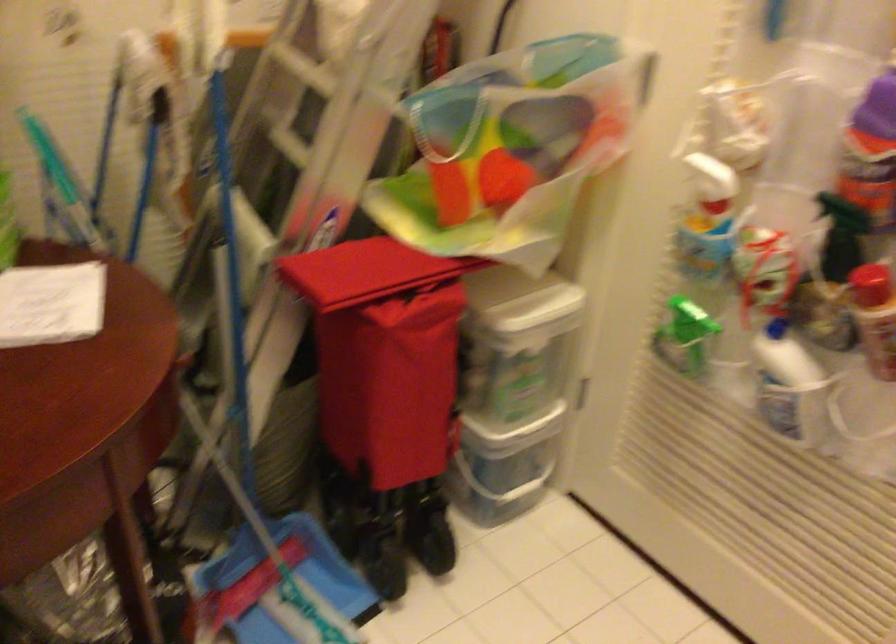
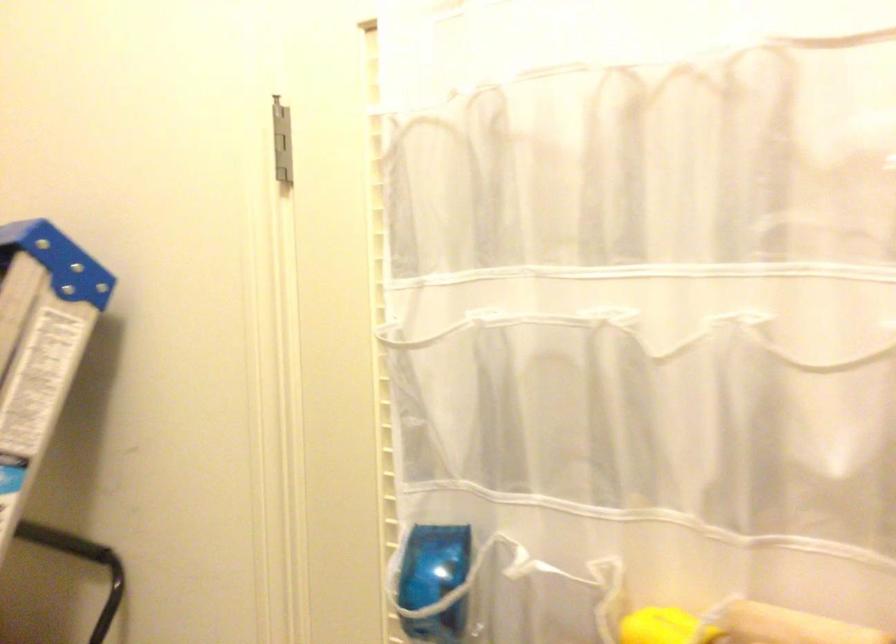
The images are taken continuously from a first-person perspective. In which direction is your viewpoint rotating?

The rotation direction of the camera is right-up.